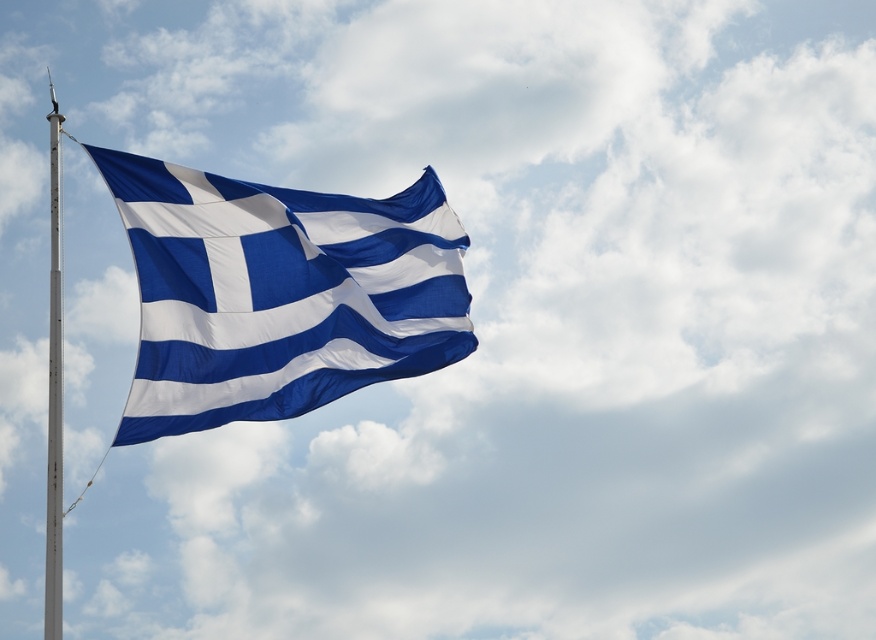
Question: Is blue fabric flag at upper left further to the viewer compared to white metallic pole at left?

Choices:
 (A) no
 (B) yes

Answer: (B)

Question: Is blue fabric flag at upper left positioned at the back of white metallic pole at left?

Choices:
 (A) no
 (B) yes

Answer: (B)

Question: Is blue fabric flag at upper left smaller than white metallic pole at left?

Choices:
 (A) no
 (B) yes

Answer: (B)

Question: Among these points, which one is nearest to the camera?

Choices:
 (A) (60, 420)
 (B) (227, 196)

Answer: (A)

Question: Which of the following is the farthest from the observer?

Choices:
 (A) blue fabric flag at upper left
 (B) white metallic pole at left

Answer: (A)